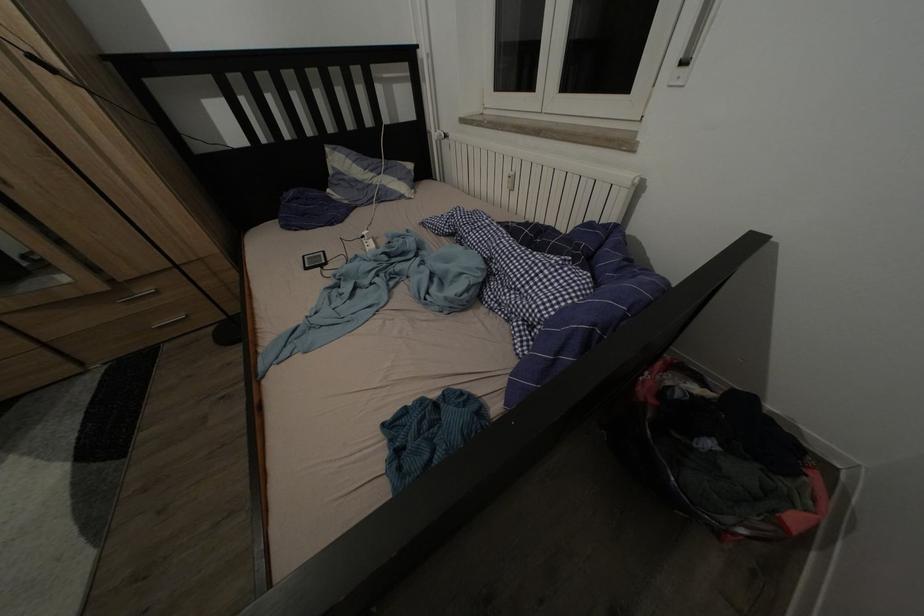
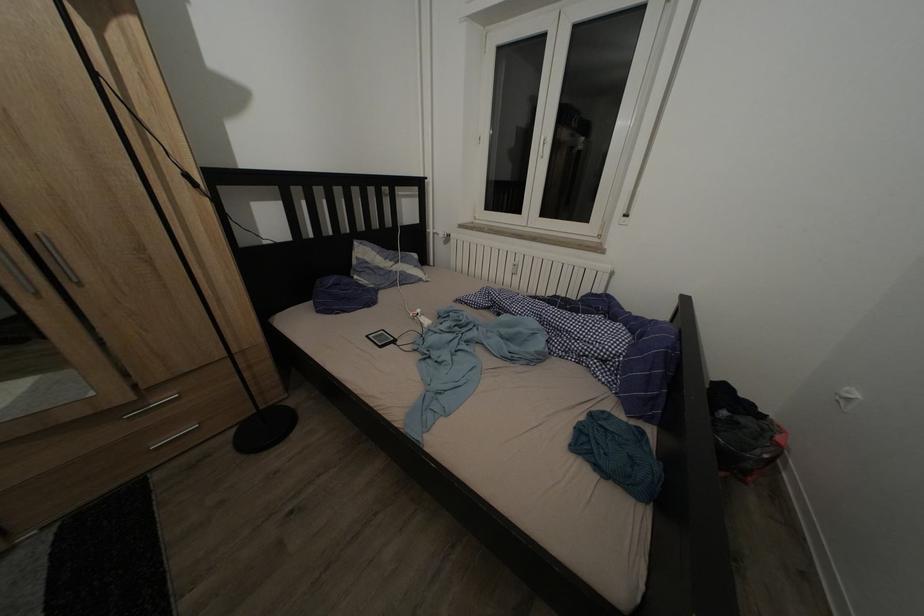
The images are taken continuously from a first-person perspective. In which direction is your viewpoint rotating?

The camera rotated toward right-up.